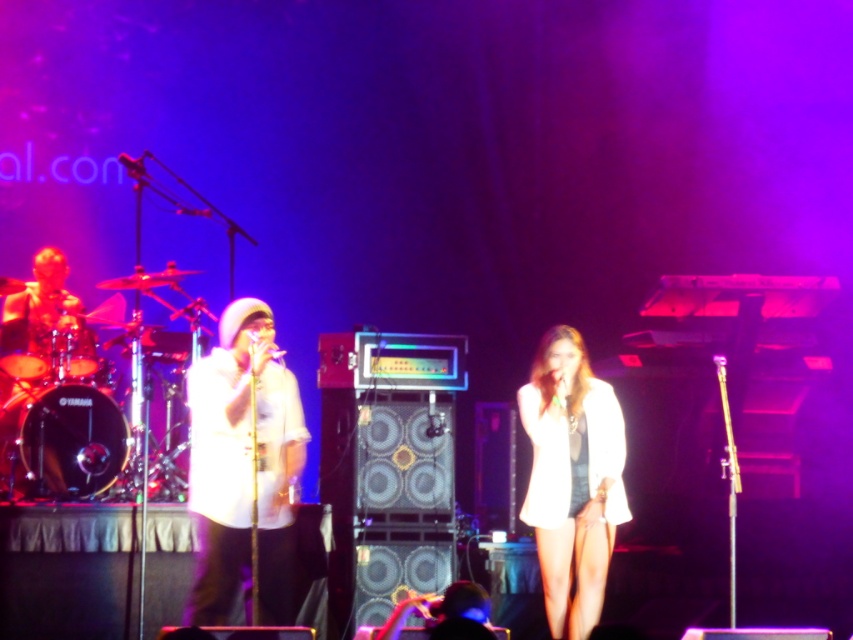
Question: Can you confirm if white matte shirt at center is wider than white fabric dress at center?

Choices:
 (A) no
 (B) yes

Answer: (B)

Question: Where is white matte shirt at center located in relation to white fabric dress at center in the image?

Choices:
 (A) above
 (B) below

Answer: (B)

Question: Which point is farther to the camera?

Choices:
 (A) white matte shirt at center
 (B) white fabric dress at center

Answer: (B)

Question: Which object is farther from the camera taking this photo?

Choices:
 (A) white fabric dress at center
 (B) white matte shirt at center

Answer: (A)

Question: Can you confirm if white matte shirt at center is positioned above white fabric dress at center?

Choices:
 (A) no
 (B) yes

Answer: (A)